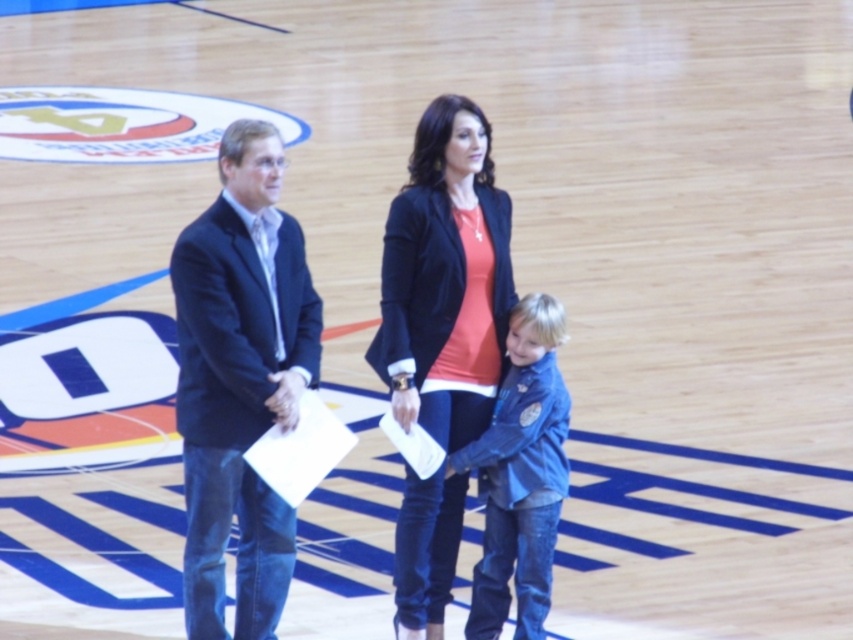
Question: Which object is closer to the camera taking this photo?

Choices:
 (A) matte black suit at left
 (B) blue denim jacket at center
 (C) dark blue suit at left

Answer: (C)

Question: Is matte black suit at left to the right of blue denim jacket at center from the viewer's perspective?

Choices:
 (A) no
 (B) yes

Answer: (A)

Question: Which object appears closest to the camera in this image?

Choices:
 (A) blue denim jacket at center
 (B) dark blue suit at left
 (C) matte black suit at left
 (D) velvet black blazer at center

Answer: (B)

Question: Does matte black suit at left have a lesser width compared to blue denim jacket at center?

Choices:
 (A) no
 (B) yes

Answer: (A)

Question: Can you confirm if matte black suit at left is positioned below velvet black blazer at center?

Choices:
 (A) yes
 (B) no

Answer: (B)

Question: Which point appears farthest from the camera in this image?

Choices:
 (A) (483, 211)
 (B) (277, 404)
 (C) (525, 534)
 (D) (450, 230)

Answer: (A)